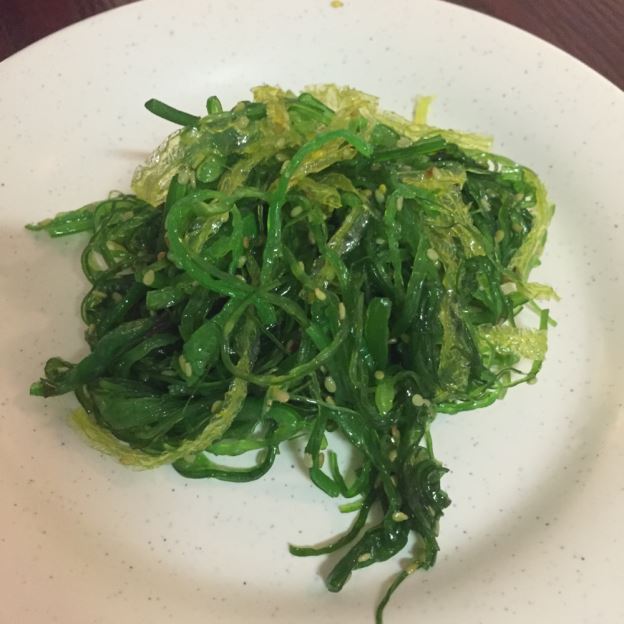
Find the location of a particular element. The height and width of the screenshot is (624, 624). white speckled dish is located at coordinates (561, 561).